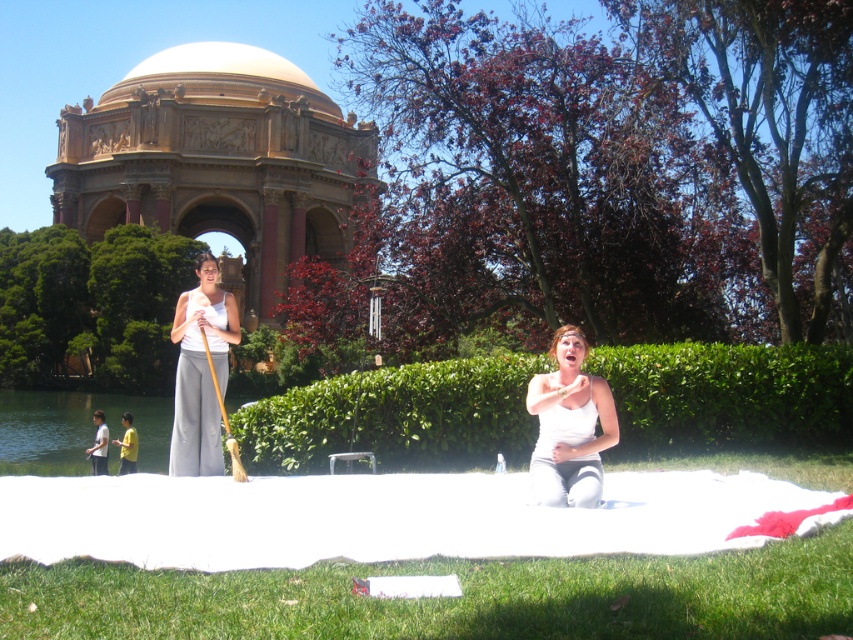
You are a photographer planning to capture a closeup of the white cotton tank top at center and the yellow fabric at lower left. Given their sizes, which one would require you to step back more to include the entire object in the frame?

The white cotton tank top at center has a greater width than the yellow fabric at lower left, so you would need to step back more to capture the white cotton tank top at center in its entirety.

You are a photographer standing at the camera position. You want to capture a closeup shot of the Palace of Fine Arts in the background while including the white fabric blanket at lower center in the frame. Given the distance between them, is it possible to have both in focus in a single shot without moving the camera?

The distance between the white fabric blanket at lower center and the camera is 39.30 meters. Since the Palace of Fine Arts is further away, the depth of field required to keep both in focus would depend on the lens aperture. At such a large distance, it might be challenging but achievable with a small aperture setting like f16 or higher to maximize depth of field.

You are a photographer standing at the Palace of Fine Arts. You want to take a photo of both the white matte tank top at lower center and the white cotton tank top at center in the same frame. Given that your camera has a maximum zoom range of 20 meters, will you be able to capture both subjects in one shot?

The distance between the white matte tank top at lower center and the white cotton tank top at center is 24.12 meters. Since your camera can only zoom up to 20 meters, you won cannot capture both subjects in one shot without moving closer or using a different lens.